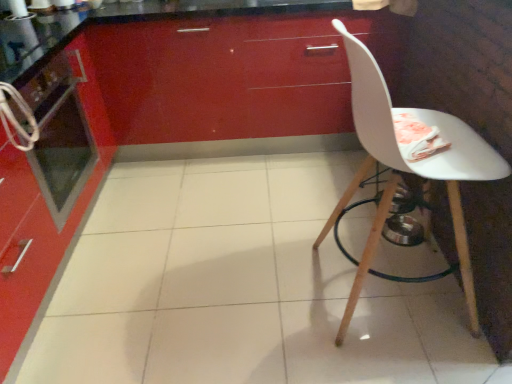
I want to click on free space below white matte chair at right (from a real-world perspective), so click(393, 297).